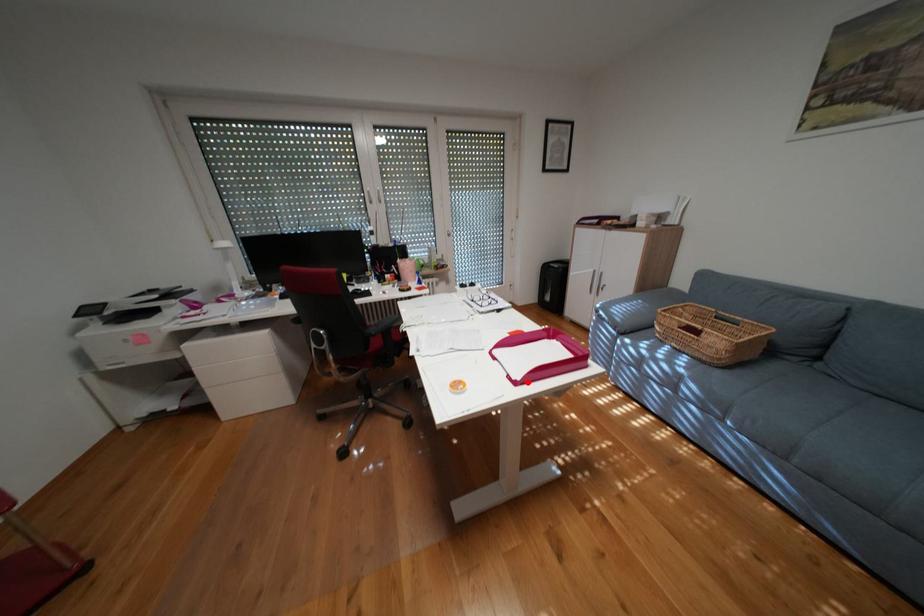
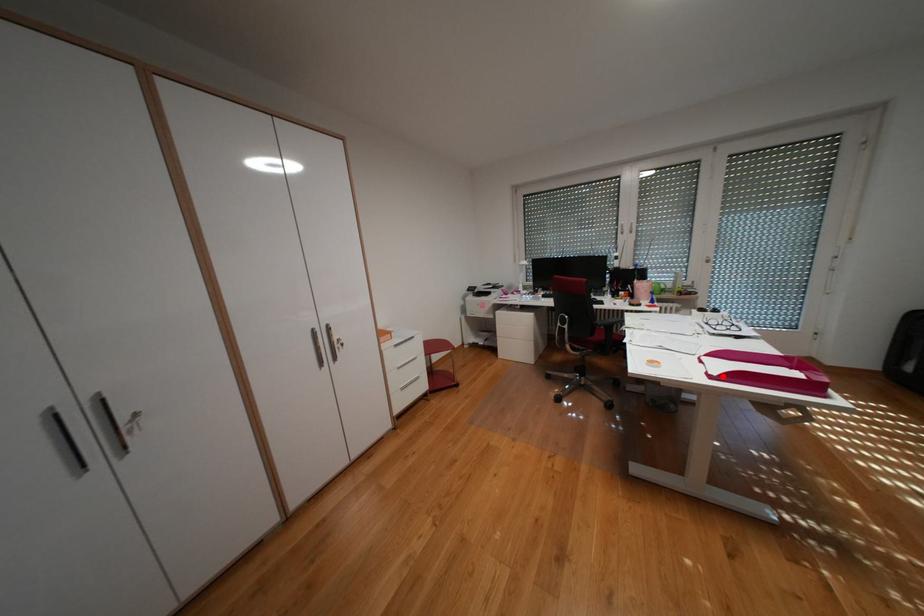
I am providing you with two images of the same scene from different viewpoints. A red point is marked on the first image and another point is marked on the second image. Are the points marked in image1 and image2 representing the same 3D position?

Yes